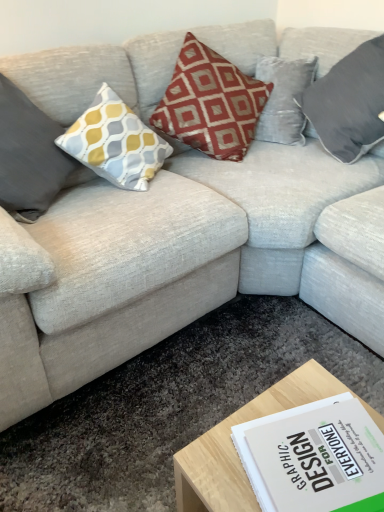
Question: In the image, is yellow-grey patterned cushion at left, the 1th pillow viewed from the left, on the left side or the right side of light wood coffee table at lower center?

Choices:
 (A) right
 (B) left

Answer: (B)

Question: In terms of width, does yellow-grey patterned cushion at left, the 1th pillow viewed from the left, look wider or thinner when compared to light wood coffee table at lower center?

Choices:
 (A) thin
 (B) wide

Answer: (A)

Question: Estimate the real-world distances between objects in this image. Which object is closer to the light wood coffee table at lower center?

Choices:
 (A) red velvet cushion at center, positioned as the second pillow in right-to-left order
 (B) yellow-grey patterned cushion at left, placed as the third pillow when sorted from right to left
 (C) velvet gray pillow at upper right, positioned as the 3th pillow in left-to-right order

Answer: (B)

Question: Which object is the closest to the red velvet cushion at center, the second pillow positioned from the left?

Choices:
 (A) velvet gray pillow at upper right, which appears as the 1th pillow when viewed from the right
 (B) yellow-grey patterned cushion at left, placed as the third pillow when sorted from right to left
 (C) light wood coffee table at lower center

Answer: (A)